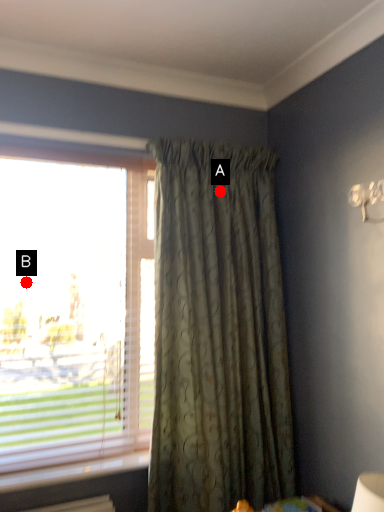
Question: Two points are circled on the image, labeled by A and B beside each circle. Which point is further to the camera?

Choices:
 (A) A is further
 (B) B is further

Answer: (A)